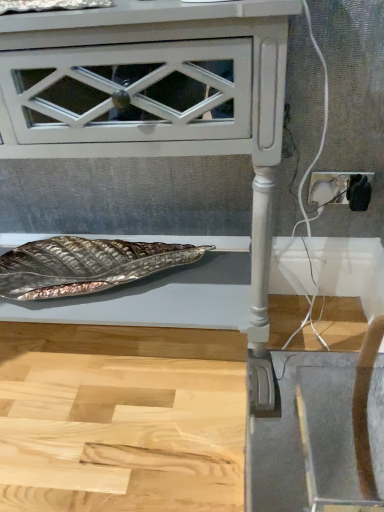
Measure the distance between point (164, 110) and camera.

They are 60.10 centimeters apart.

The width and height of the screenshot is (384, 512). What do you see at coordinates (156, 135) in the screenshot?
I see `white glossy leaf tray at lower center` at bounding box center [156, 135].

At what (x,y) coordinates should I click in order to perform the action: click on white glossy leaf tray at lower center. Please return your answer as a coordinate pair (x, y). The width and height of the screenshot is (384, 512). Looking at the image, I should click on (156, 135).

Image resolution: width=384 pixels, height=512 pixels. Describe the element at coordinates (341, 189) in the screenshot. I see `white plastic socket at right` at that location.

What is the approximate height of white plastic socket at right?

The height of white plastic socket at right is 9.73 centimeters.

Identify the location of white plastic socket at right. (341, 189).

The image size is (384, 512). Identify the location of white glossy leaf tray at lower center. pos(156,135).

Considering the positions of objects white plastic socket at right and white glossy leaf tray at lower center in the image provided, who is more to the left, white plastic socket at right or white glossy leaf tray at lower center?

white glossy leaf tray at lower center is more to the left.

Considering the relative positions of white plastic socket at right and white glossy leaf tray at lower center in the image provided, is white plastic socket at right in front of white glossy leaf tray at lower center?

No, it is not.

Is point (366, 197) closer to viewer compared to point (226, 90)?

No, it is behind (226, 90).

From the image's perspective, does white plastic socket at right appear higher than white glossy leaf tray at lower center?

Yes.

From a real-world perspective, does white plastic socket at right sit lower than white glossy leaf tray at lower center?

Indeed, from a real-world perspective, white plastic socket at right is positioned beneath white glossy leaf tray at lower center.

Considering the relative sizes of white plastic socket at right and white glossy leaf tray at lower center in the image provided, is white plastic socket at right wider than white glossy leaf tray at lower center?

No, white plastic socket at right is not wider than white glossy leaf tray at lower center.

Consider the image. Who is shorter, white plastic socket at right or white glossy leaf tray at lower center?

white plastic socket at right is shorter.

Based on their sizes in the image, would you say white plastic socket at right is bigger or smaller than white glossy leaf tray at lower center?

Considering their sizes, white plastic socket at right takes up less space than white glossy leaf tray at lower center.

Is white plastic socket at right situated inside white glossy leaf tray at lower center or outside?

The correct answer is: outside.

Is white plastic socket at right directly adjacent to white glossy leaf tray at lower center?

white plastic socket at right and white glossy leaf tray at lower center are not in contact.

Looking at this image, is white plastic socket at right aimed at white glossy leaf tray at lower center?

No, white plastic socket at right is not aimed at white glossy leaf tray at lower center.

How many degrees apart are the facing directions of white plastic socket at right and white glossy leaf tray at lower center?

The angular difference between white plastic socket at right and white glossy leaf tray at lower center is 0.00332 degrees.

At what (x,y) coordinates should I click in order to perform the action: click on electric outlet behind the white glossy leaf tray at lower center. Please return your answer as a coordinate pair (x, y). Looking at the image, I should click on (341, 189).

Which is more to the right, white glossy leaf tray at lower center or white plastic socket at right?

Positioned to the right is white plastic socket at right.

Is white glossy leaf tray at lower center behind white plastic socket at right?

No, it is not.

Which is closer to the camera, (x=232, y=131) or (x=362, y=192)?

The point (x=232, y=131) is closer to the camera.

From the image's perspective, would you say white glossy leaf tray at lower center is shown under white plastic socket at right?

Correct, white glossy leaf tray at lower center appears lower than white plastic socket at right in the image.

From a real-world perspective, is white glossy leaf tray at lower center physically located above or below white plastic socket at right?

Clearly, from a real-world perspective, white glossy leaf tray at lower center is above white plastic socket at right.

Considering the relative sizes of white glossy leaf tray at lower center and white plastic socket at right in the image provided, is white glossy leaf tray at lower center thinner than white plastic socket at right?

No.

Which of these two, white glossy leaf tray at lower center or white plastic socket at right, stands taller?

white glossy leaf tray at lower center is taller.

Between white glossy leaf tray at lower center and white plastic socket at right, which one has larger size?

Bigger between the two is white glossy leaf tray at lower center.

Is white glossy leaf tray at lower center located outside white plastic socket at right?

Yes.

Are white glossy leaf tray at lower center and white plastic socket at right located far from each other?

No, white glossy leaf tray at lower center is not far from white plastic socket at right.

Based on the photo, is white glossy leaf tray at lower center facing away from white plastic socket at right?

No, white plastic socket at right is not at the back of white glossy leaf tray at lower center.

How different are the orientations of white glossy leaf tray at lower center and white plastic socket at right in degrees?

0.00332 degrees separate the facing orientations of white glossy leaf tray at lower center and white plastic socket at right.

You are a GUI agent. You are given a task and a screenshot of the screen. Output one action in this format:
    pyautogui.click(x=<x>, y=<y>)
    Task: Click on the furniture in front of the white plastic socket at right
    
    Given the screenshot: What is the action you would take?
    pyautogui.click(x=156, y=135)

You are a GUI agent. You are given a task and a screenshot of the screen. Output one action in this format:
    pyautogui.click(x=<x>, y=<y>)
    Task: Click on the furniture on the left side of white plastic socket at right
    This screenshot has width=384, height=512.
    Given the screenshot: What is the action you would take?
    pyautogui.click(x=156, y=135)

Find the location of a particular element. electric outlet that is behind the white glossy leaf tray at lower center is located at coordinates (341, 189).